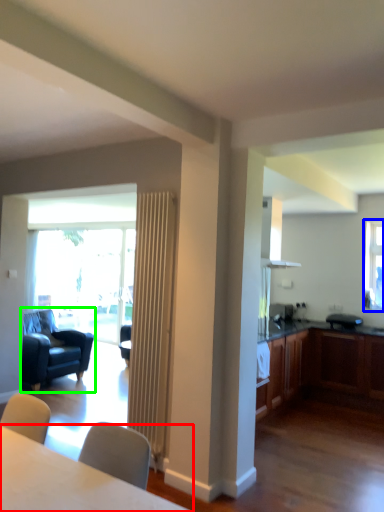
Question: Which object is positioned farthest from table (highlighted by a red box)? Select from window (highlighted by a blue box) and chair (highlighted by a green box).

Choices:
 (A) window
 (B) chair

Answer: (A)